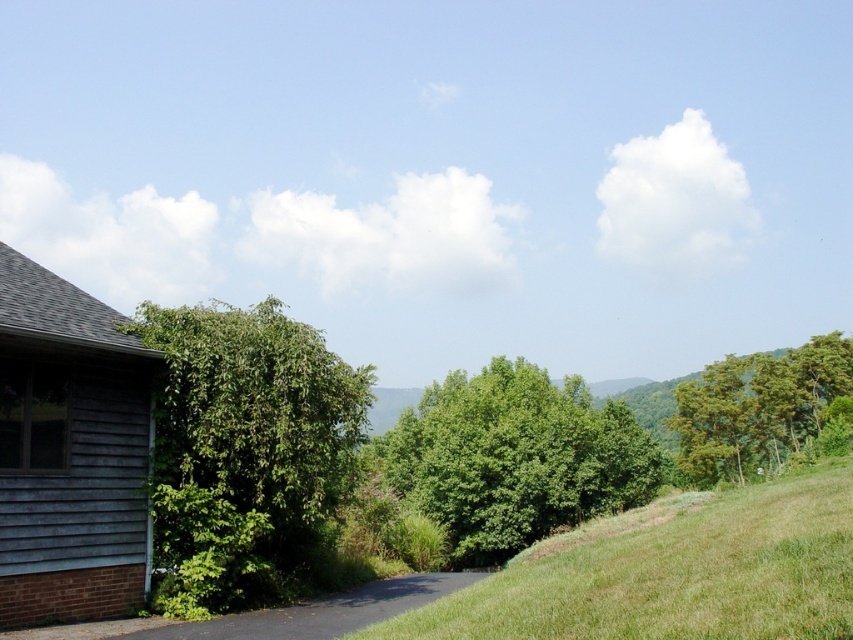
Between green leafy tree at center and green leafy tree at right, which one appears on the right side from the viewer's perspective?

Positioned to the right is green leafy tree at right.

Does green leafy tree at center appear on the right side of green leafy tree at right?

No, green leafy tree at center is not to the right of green leafy tree at right.

Identify the location of green leafy tree at center. (515, 458).

Does green leafy tree at right have a greater width compared to black asphalt driveway at lower left?

Yes, green leafy tree at right is wider than black asphalt driveway at lower left.

Between green leafy tree at right and black asphalt driveway at lower left, which one is positioned higher?

black asphalt driveway at lower left is above.

What do you see at coordinates (757, 406) in the screenshot?
I see `green leafy tree at right` at bounding box center [757, 406].

Locate an element on the screen. The image size is (853, 640). green leafy tree at right is located at coordinates (757, 406).

Is green leafy tree at center further to the viewer compared to black asphalt driveway at lower left?

Yes, it is behind black asphalt driveway at lower left.

Between green leafy tree at center and black asphalt driveway at lower left, which one appears on the right side from the viewer's perspective?

green leafy tree at center is more to the right.

Is point (602, 417) closer to viewer compared to point (463, 580)?

No.

The width and height of the screenshot is (853, 640). Identify the location of green leafy tree at center. (515, 458).